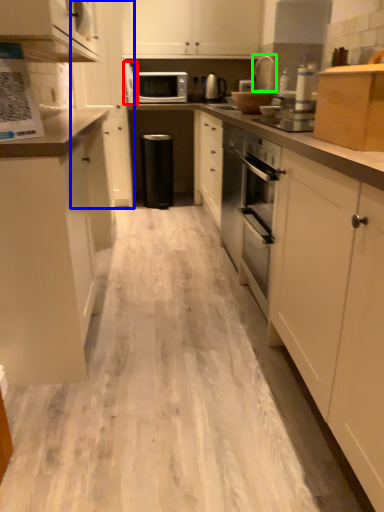
Question: Considering the real-world distances, which object is farthest from appliance (highlighted by a red box)? cabinetry (highlighted by a blue box) or appliance (highlighted by a green box)?

Choices:
 (A) cabinetry
 (B) appliance

Answer: (B)